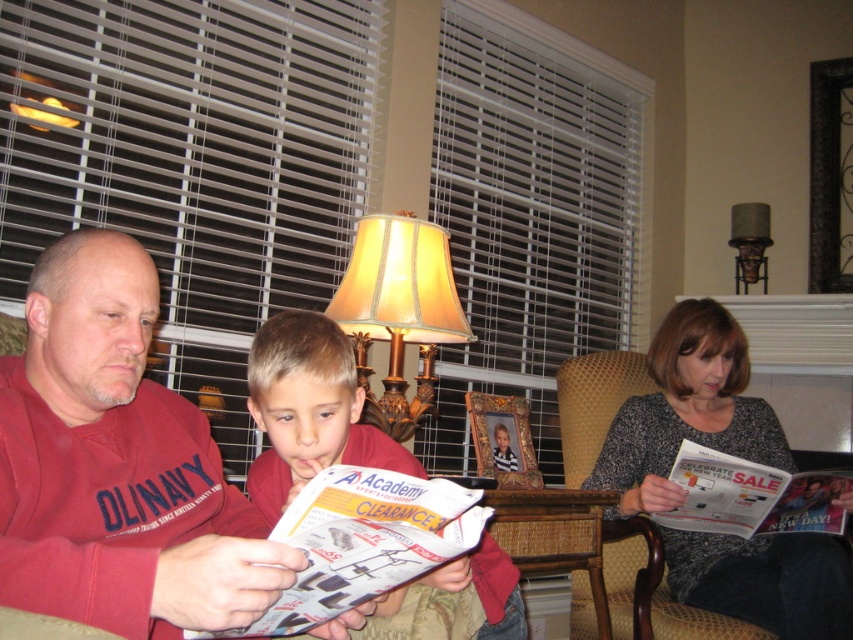
Question: Does matte beige lampshade at center have a lesser width compared to matte paper magazine at lower right?

Choices:
 (A) yes
 (B) no

Answer: (A)

Question: Does speckled gray sweater at center appear on the left side of matte red shirt at center?

Choices:
 (A) no
 (B) yes

Answer: (A)

Question: Which object is farther from the camera taking this photo?

Choices:
 (A) matte beige lampshade at center
 (B) white glossy magazine at center
 (C) speckled gray sweater at center

Answer: (A)

Question: Does speckled gray sweater at center lie behind matte paper magazine at lower right?

Choices:
 (A) yes
 (B) no

Answer: (B)

Question: Which of the following is the closest to the observer?

Choices:
 (A) white glossy magazine at center
 (B) speckled gray sweater at center
 (C) matte red shirt at center
 (D) matte beige lampshade at center

Answer: (A)

Question: Based on their relative distances, which object is farther from the white glossy magazine at center?

Choices:
 (A) matte paper magazine at lower right
 (B) matte red shirt at center
 (C) matte beige lampshade at center

Answer: (A)